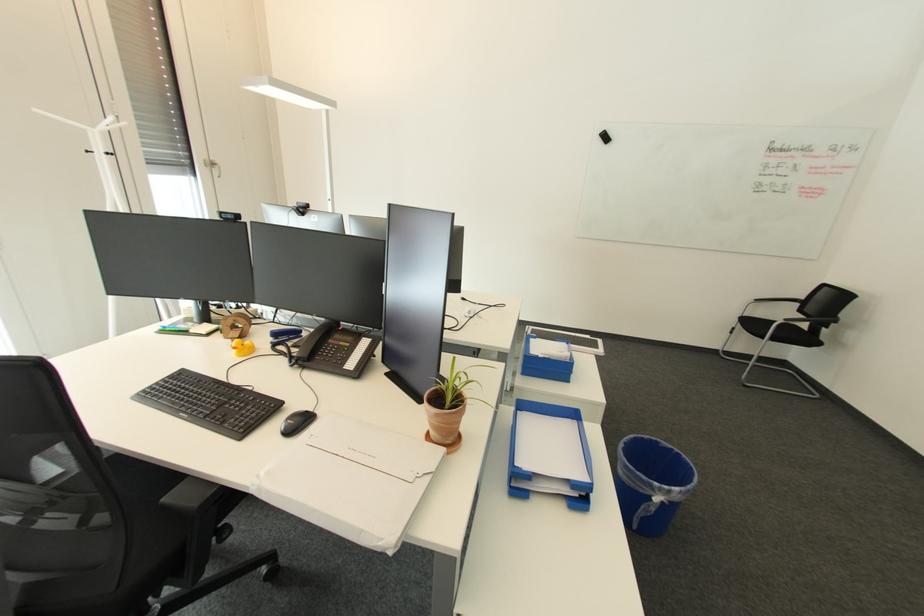
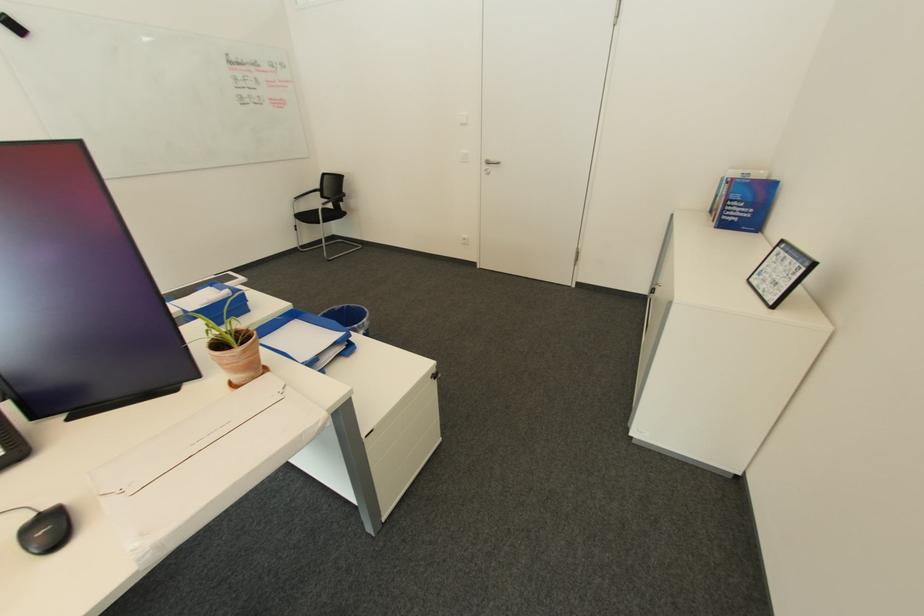
First-person continuous shooting, in which direction is the camera rotating?

The rotation direction of the camera is right-down.